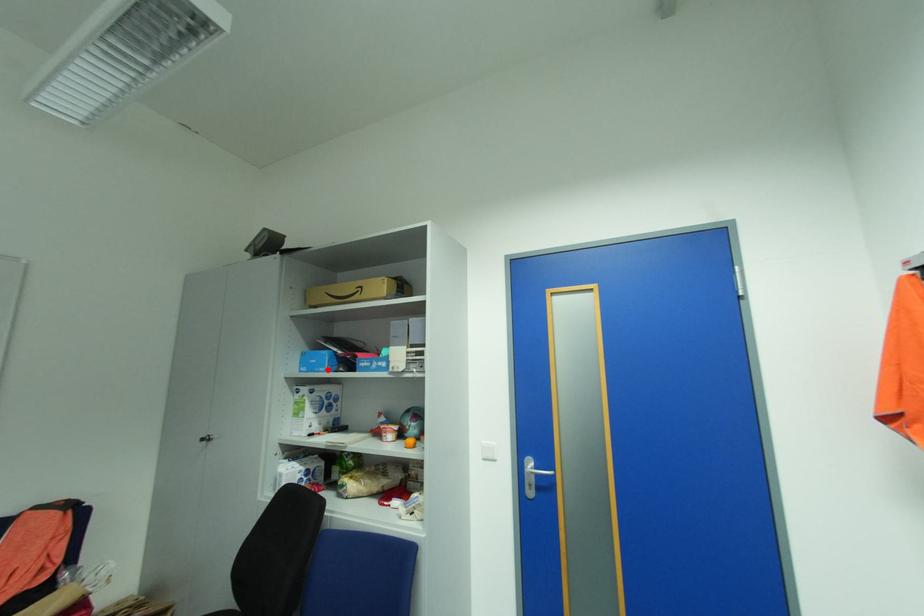
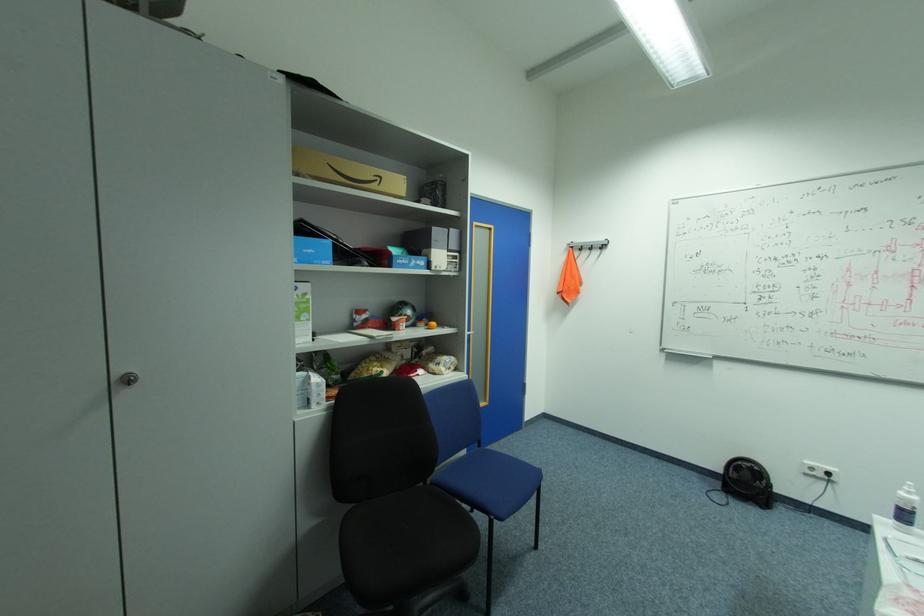
Locate, in the second image, the point that corresponds to the highlighted location in the first image.

(331, 262)